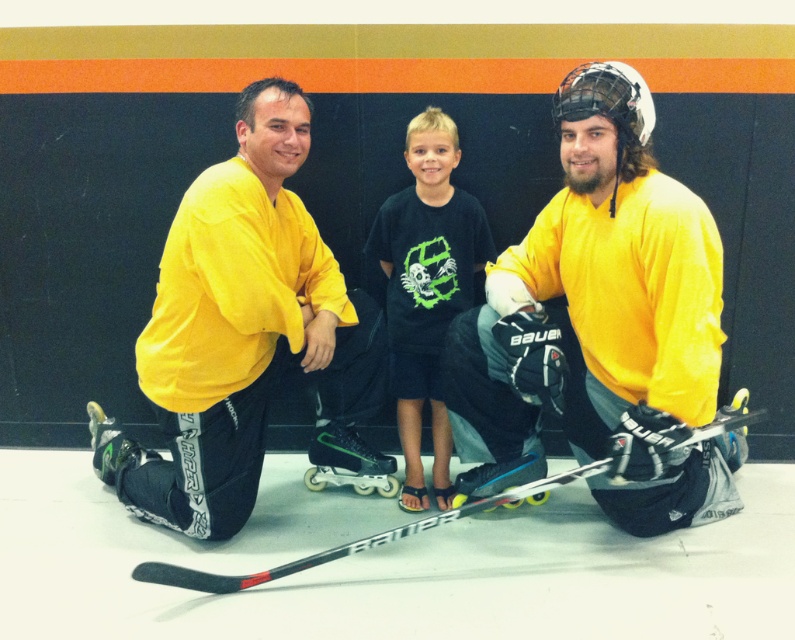
Can you confirm if matte yellow jersey at center is positioned below black matte hockey stick at center?

No, matte yellow jersey at center is not below black matte hockey stick at center.

Which is in front, point (235, 401) or point (436, 522)?

Point (436, 522) is more forward.

What are the coordinates of `matte yellow jersey at center` in the screenshot? It's located at (243, 333).

Is matte yellow jersey at center smaller than black cotton shirt at center?

Incorrect, matte yellow jersey at center is not smaller in size than black cotton shirt at center.

Can you confirm if matte yellow jersey at center is positioned above black cotton shirt at center?

No.

Where is `matte yellow jersey at center`? matte yellow jersey at center is located at coordinates (243, 333).

Which is below, yellow matte hockey jersey at right or black cotton shirt at center?

yellow matte hockey jersey at right is lower down.

Is yellow matte hockey jersey at right taller than black cotton shirt at center?

Yes.

Locate an element on the screen. The width and height of the screenshot is (795, 640). yellow matte hockey jersey at right is located at coordinates (600, 323).